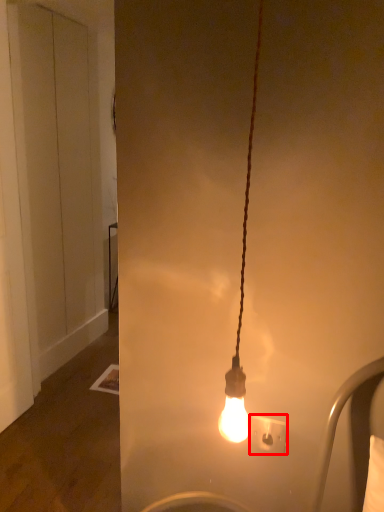
Question: From the image's perspective, where is power plugs and sockets (annotated by the red box) located in relation to door in the image?

Choices:
 (A) above
 (B) below

Answer: (B)